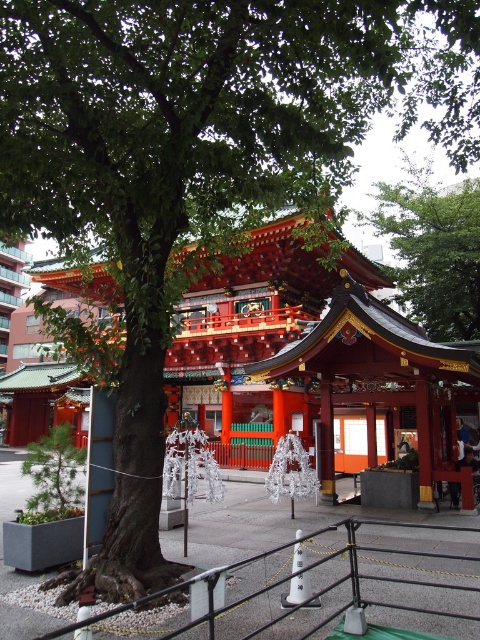
Is black metal/rail at center positioned in front of green leafy tree at upper center?

Yes, it is in front of green leafy tree at upper center.

Describe the element at coordinates (360, 582) in the screenshot. This screenshot has height=640, width=480. I see `black metal/rail at center` at that location.

What do you see at coordinates (360, 582) in the screenshot? Image resolution: width=480 pixels, height=640 pixels. I see `black metal/rail at center` at bounding box center [360, 582].

Locate an element on the screen. The width and height of the screenshot is (480, 640). black metal/rail at center is located at coordinates (360, 582).